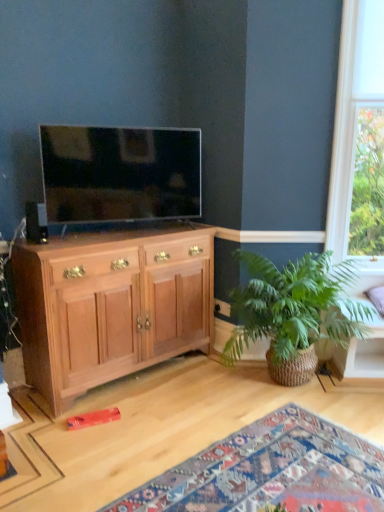
Locate an element on the screen. The width and height of the screenshot is (384, 512). vacant location behind matte black speaker at left is located at coordinates (50, 234).